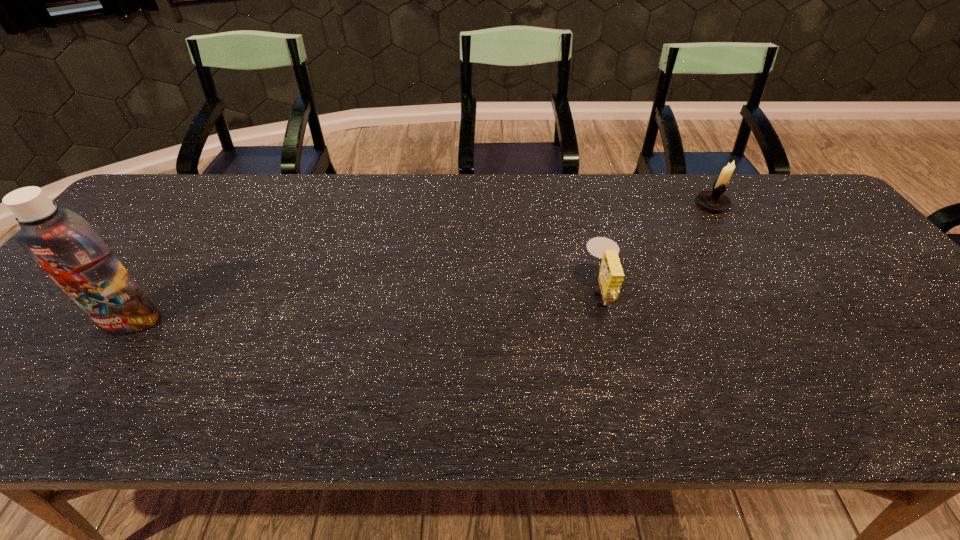
The height and width of the screenshot is (540, 960). I want to click on the leftmost object, so click(x=64, y=244).

Where is `the tallest object`? the tallest object is located at coordinates (64, 244).

In order to click on the second shortest object in this screenshot , I will do `click(715, 200)`.

Image resolution: width=960 pixels, height=540 pixels. What are the coordinates of `the rightmost object` in the screenshot? It's located at (715, 200).

Find the location of a particular element. The width and height of the screenshot is (960, 540). the second object from right to left is located at coordinates (611, 275).

The image size is (960, 540). What are the coordinates of `the shortest object` in the screenshot? It's located at (611, 275).

Where is `vacant area situated 0.070m on the front label of the leftmost object`? This screenshot has height=540, width=960. vacant area situated 0.070m on the front label of the leftmost object is located at coordinates (102, 362).

Where is `free space located on the left of the rightmost object`? free space located on the left of the rightmost object is located at coordinates (649, 204).

Identify the location of free location located 0.340m on the front-facing side of the sponge. Image resolution: width=960 pixels, height=540 pixels. (446, 292).

Identify the location of blank space located on the front-facing side of the sponge. (552, 292).